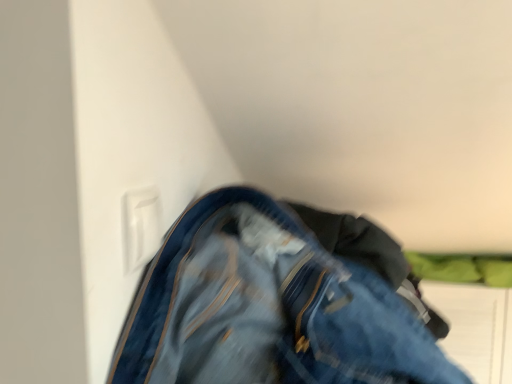
Describe the element at coordinates (267, 308) in the screenshot. The width and height of the screenshot is (512, 384). I see `denim at center` at that location.

Image resolution: width=512 pixels, height=384 pixels. In order to click on denim at center in this screenshot , I will do `click(267, 308)`.

Measure the distance between point (x=272, y=319) and camera.

Point (x=272, y=319) and camera are 18.35 inches apart.

In order to face denim at center, should I rotate leftwards or rightwards?

Rotate right and turn 15.590 degrees.

Where is `denim at center`? denim at center is located at coordinates (267, 308).